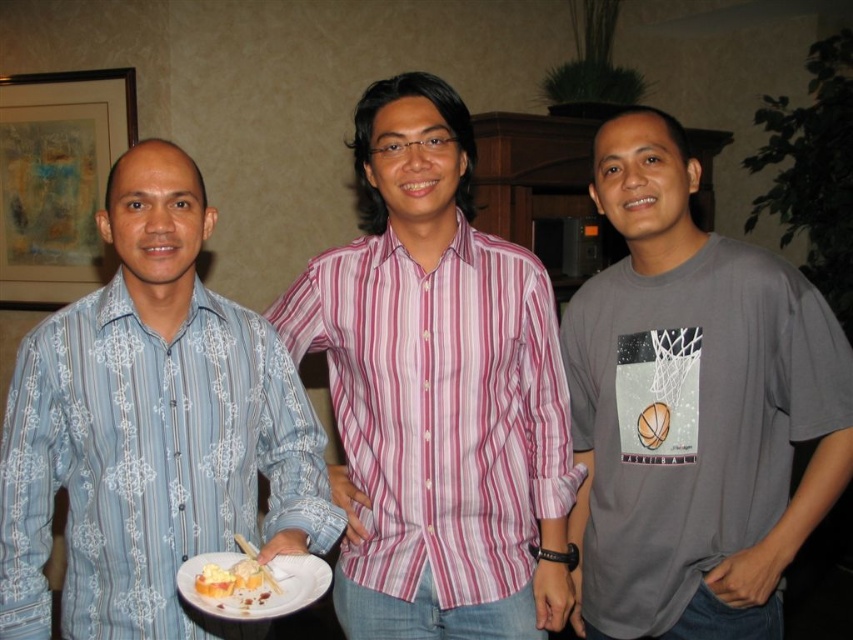
Question: Can you confirm if pink striped shirt at center is positioned to the left of yellowish creamy bread at center?

Choices:
 (A) no
 (B) yes

Answer: (A)

Question: Considering the real-world distances, which object is farthest from the white matte plate at center?

Choices:
 (A) yellowish creamy bread at center
 (B) blue printed shirt at left
 (C) pink striped shirt at center

Answer: (C)

Question: Among these objects, which one is farthest from the camera?

Choices:
 (A) yellowish creamy bread at center
 (B) blue printed shirt at left
 (C) gray cotton t-shirt at center

Answer: (C)

Question: Is white matte plate at center wider than yellowish creamy bread at center?

Choices:
 (A) no
 (B) yes

Answer: (B)

Question: Considering the real-world distances, which object is closest to the yellowish creamy bread at center?

Choices:
 (A) gray cotton t-shirt at center
 (B) blue printed shirt at left
 (C) pink striped shirt at center

Answer: (B)

Question: Is pink striped shirt at center to the right of gray cotton t-shirt at center from the viewer's perspective?

Choices:
 (A) yes
 (B) no

Answer: (B)